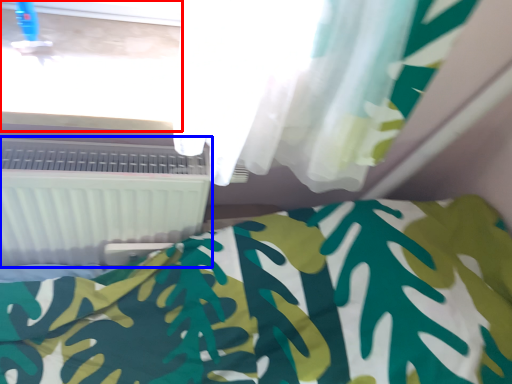
Question: Which object is further to the camera taking this photo, window frame (highlighted by a red box) or air conditioning (highlighted by a blue box)?

Choices:
 (A) window frame
 (B) air conditioning

Answer: (B)